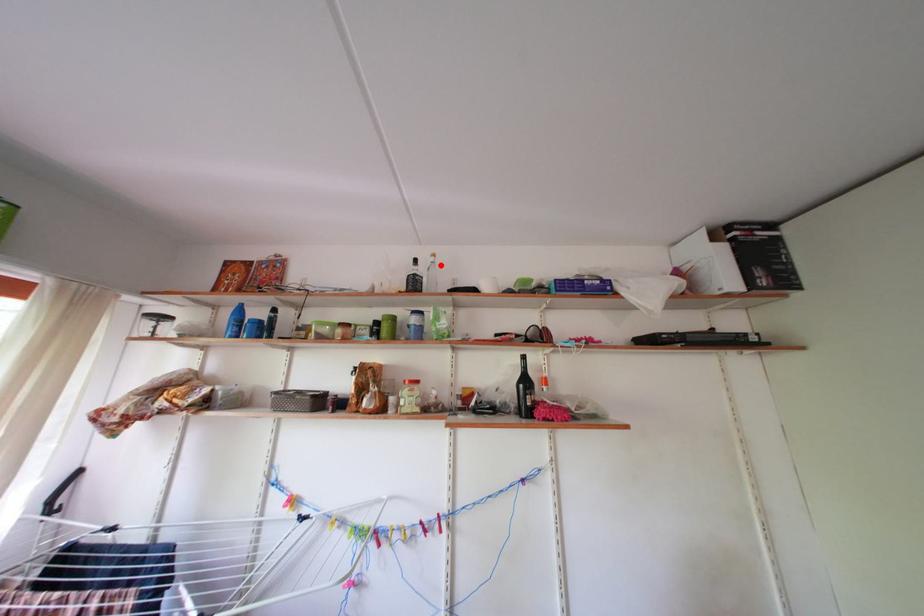
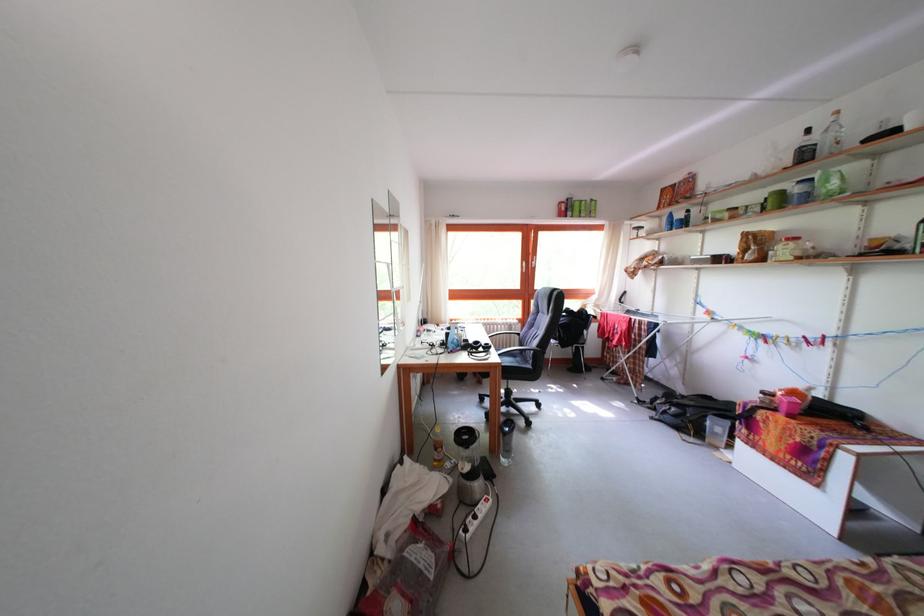
Where in the second image is the point corresponding to the highlighted location from the first image?

(843, 124)